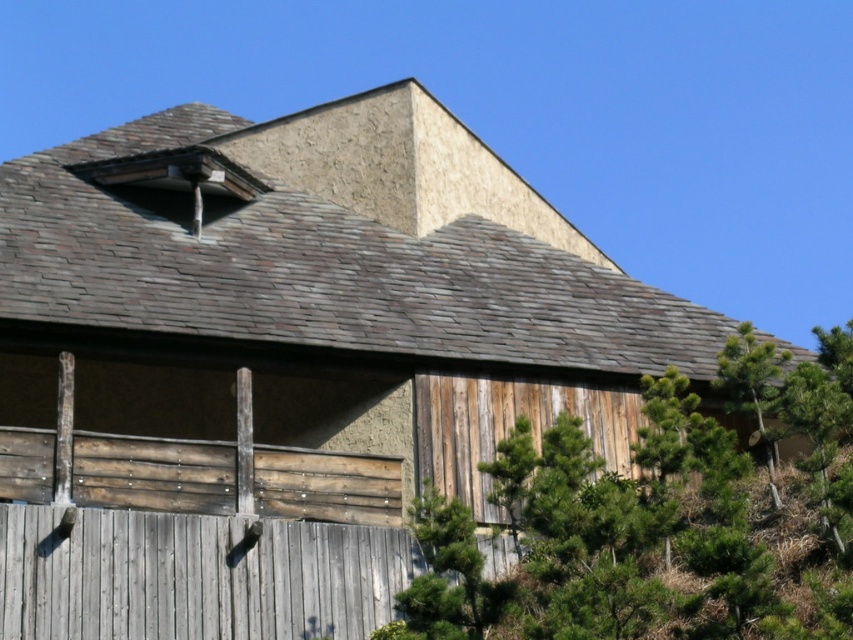
Question: Is green leafy tree at center to the right of green textured pine tree at right from the viewer's perspective?

Choices:
 (A) no
 (B) yes

Answer: (A)

Question: Which of the following is the farthest from the observer?

Choices:
 (A) (726, 356)
 (B) (799, 618)

Answer: (A)

Question: From the image, what is the correct spatial relationship of green leafy tree at center in relation to green textured pine tree at right?

Choices:
 (A) below
 (B) above

Answer: (A)

Question: Is green leafy tree at center further to camera compared to green textured pine tree at right?

Choices:
 (A) yes
 (B) no

Answer: (B)

Question: Which object appears farthest from the camera in this image?

Choices:
 (A) green textured pine tree at right
 (B) green leafy tree at center

Answer: (A)